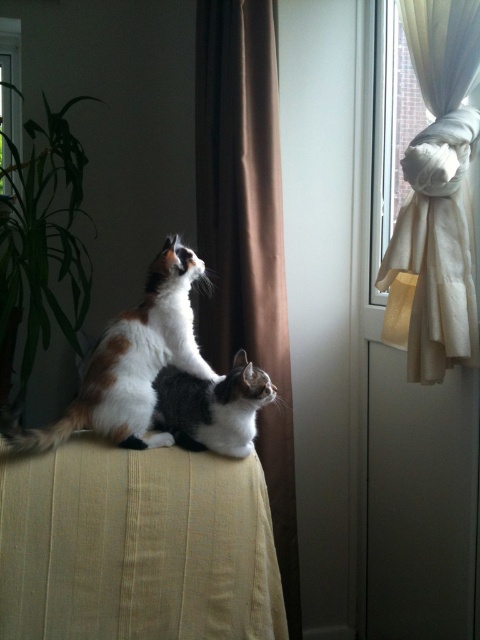
Question: Is brown fabric curtain at center to the right of black-and-white fur cat at center from the viewer's perspective?

Choices:
 (A) no
 (B) yes

Answer: (B)

Question: Is brown fabric curtain at center thinner than calico fur cat at center?

Choices:
 (A) yes
 (B) no

Answer: (A)

Question: Which object appears farthest from the camera in this image?

Choices:
 (A) white sheer curtain at upper right
 (B) black-and-white fur cat at center
 (C) transparent glass window at upper center

Answer: (C)

Question: Which point is closer to the camera?

Choices:
 (A) white sheer curtain at upper right
 (B) brown fabric curtain at center

Answer: (A)

Question: Which object is the closest to the black-and-white fur cat at center?

Choices:
 (A) transparent glass window at upper center
 (B) calico fur cat at center
 (C) white sheer curtain at upper right

Answer: (B)

Question: From the image, what is the correct spatial relationship of brown fabric curtain at center in relation to transparent glass window at upper center?

Choices:
 (A) above
 (B) below

Answer: (B)